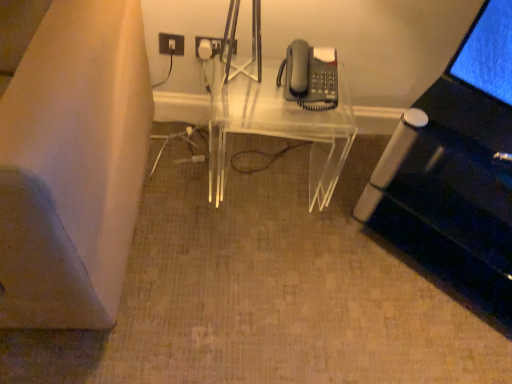
The width and height of the screenshot is (512, 384). Identify the location of free space to the left of transparent acrylic table at center. (178, 169).